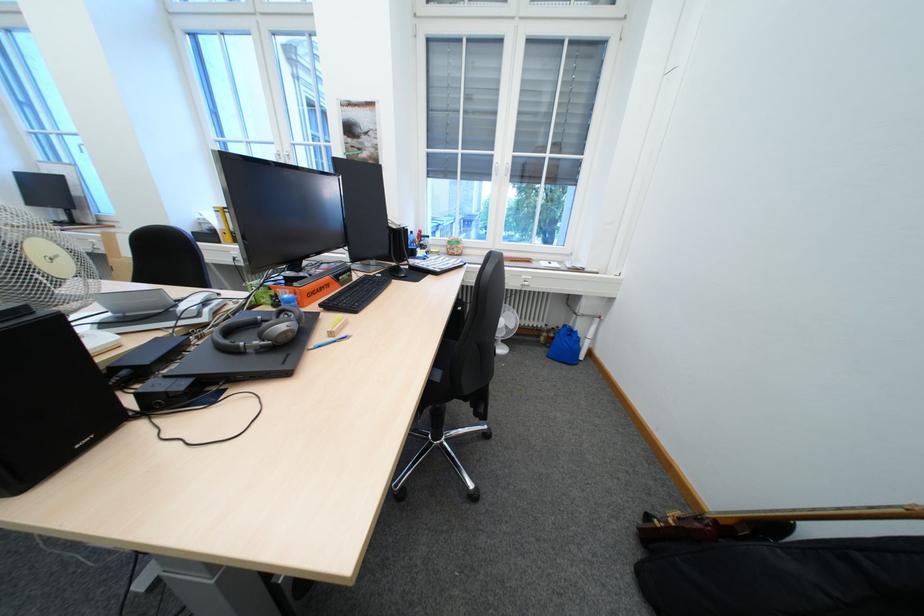
Locate an element on the screen. The height and width of the screenshot is (616, 924). chair sitting surface is located at coordinates (444, 361).